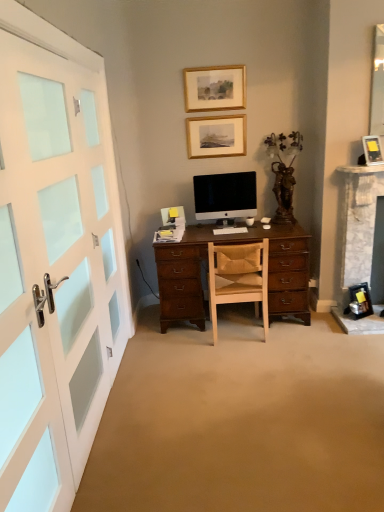
Question: Considering the positions of brown wooden statue at upper right and satin black monitor at center in the image, is brown wooden statue at upper right bigger or smaller than satin black monitor at center?

Choices:
 (A) big
 (B) small

Answer: (A)

Question: Relative to satin black monitor at center, is brown wooden statue at upper right in front or behind?

Choices:
 (A) behind
 (B) front

Answer: (B)

Question: Which object is positioned closest to the brown wooden statue at upper right?

Choices:
 (A) white matte computer keyboard at center
 (B) gold/glossy picture frame at upper center, the 1th picture frame from the top
 (C) satin black monitor at center
 (D) wooden chair at center
 (E) white painted wood door at left

Answer: (C)

Question: Based on their relative distances, which object is farther from the white glossy computer mouse at center?

Choices:
 (A) gold/glossy picture frame at upper center, arranged as the 3th picture frame when ordered from the bottom
 (B) wooden picture frame at upper center, the third picture frame in the front-to-back sequence
 (C) brown wooden statue at upper right
 (D) wooden chair at center
 (E) matte black picture frame at upper right, the 1th picture frame in the bottom-to-top sequence

Answer: (A)